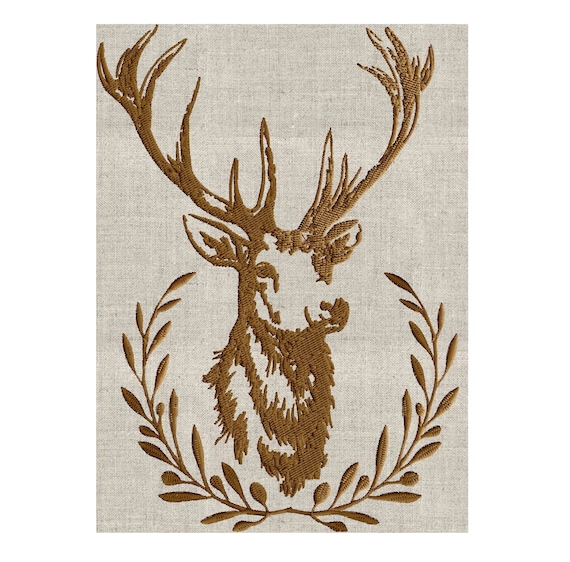
You are a GUI agent. You are given a task and a screenshot of the screen. Output one action in this format:
    pyautogui.click(x=<x>, y=<y>)
    Task: Click on the fabric
    
    Given the screenshot: What is the action you would take?
    pyautogui.click(x=398, y=221)